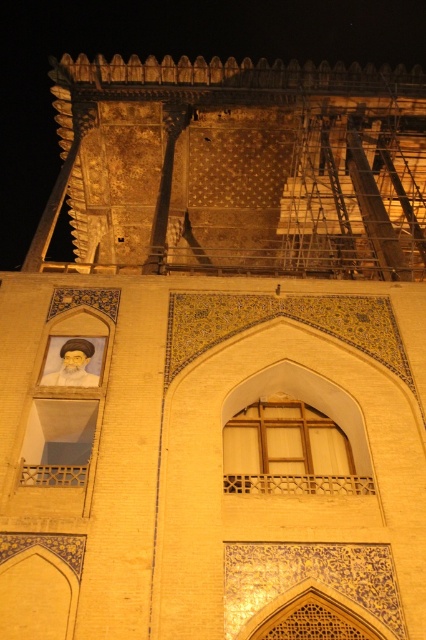
Question: Can you confirm if wooden at center is positioned below white matte window at lower left?

Choices:
 (A) no
 (B) yes

Answer: (B)

Question: Which of the following is the farthest from the observer?

Choices:
 (A) white matte window at lower left
 (B) gold mosaic wall at upper center

Answer: (B)

Question: Can you confirm if gold mosaic wall at upper center is bigger than wooden at center?

Choices:
 (A) no
 (B) yes

Answer: (B)

Question: Considering the relative positions of wooden at center and white matte window at lower left in the image provided, where is wooden at center located with respect to white matte window at lower left?

Choices:
 (A) below
 (B) above

Answer: (A)

Question: Among these objects, which one is farthest from the camera?

Choices:
 (A) gold mosaic wall at upper center
 (B) white matte window at lower left

Answer: (A)

Question: Which object is positioned closest to the white matte window at lower left?

Choices:
 (A) wooden at center
 (B) gold mosaic wall at upper center

Answer: (A)